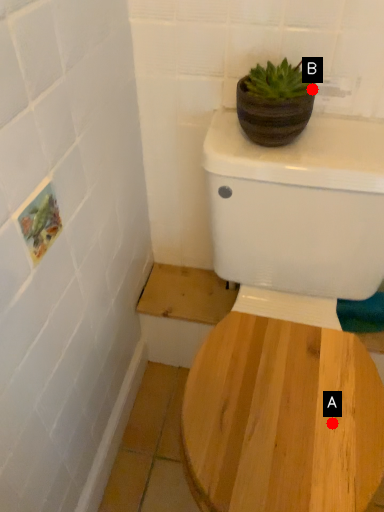
Question: Two points are circled on the image, labeled by A and B beside each circle. Which of the following is the closest to the observer?

Choices:
 (A) A is closer
 (B) B is closer

Answer: (A)